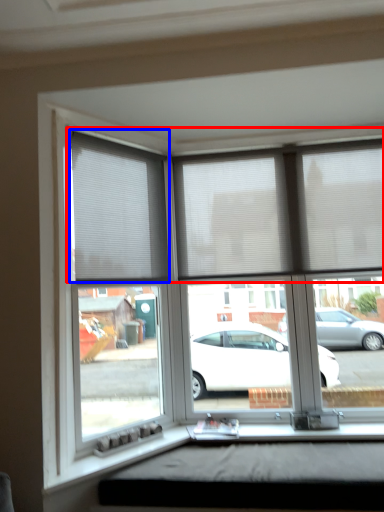
Question: Which point is further to the camera, blind (highlighted by a red box) or window blind (highlighted by a blue box)?

Choices:
 (A) blind
 (B) window blind

Answer: (A)